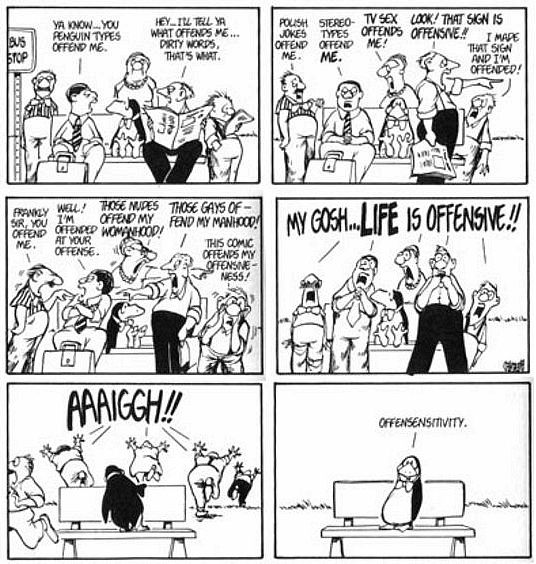
Image resolution: width=536 pixels, height=564 pixels. Identify the location of benches. (103, 124), (379, 117), (413, 321), (144, 320), (167, 504), (347, 493).